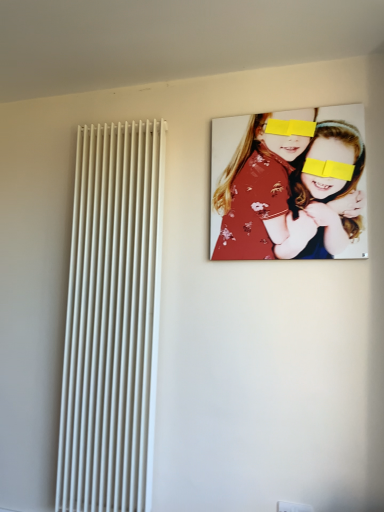
Question: Can you confirm if white smooth radiator at left is positioned to the right of floral fabric portrait at upper right?

Choices:
 (A) no
 (B) yes

Answer: (A)

Question: Is white smooth radiator at left at the left side of floral fabric portrait at upper right?

Choices:
 (A) no
 (B) yes

Answer: (B)

Question: From a real-world perspective, is white smooth radiator at left located beneath floral fabric portrait at upper right?

Choices:
 (A) yes
 (B) no

Answer: (A)

Question: From the image's perspective, is white smooth radiator at left over floral fabric portrait at upper right?

Choices:
 (A) yes
 (B) no

Answer: (B)

Question: Does white smooth radiator at left contain floral fabric portrait at upper right?

Choices:
 (A) yes
 (B) no

Answer: (B)

Question: Is white smooth radiator at left facing away from floral fabric portrait at upper right?

Choices:
 (A) yes
 (B) no

Answer: (B)

Question: Is floral fabric portrait at upper right next to white smooth radiator at left?

Choices:
 (A) yes
 (B) no

Answer: (B)

Question: Can you confirm if floral fabric portrait at upper right is taller than white smooth radiator at left?

Choices:
 (A) no
 (B) yes

Answer: (A)

Question: From a real-world perspective, is floral fabric portrait at upper right below white smooth radiator at left?

Choices:
 (A) no
 (B) yes

Answer: (A)

Question: Does floral fabric portrait at upper right have a larger size compared to white smooth radiator at left?

Choices:
 (A) no
 (B) yes

Answer: (A)

Question: Can white smooth radiator at left be found inside floral fabric portrait at upper right?

Choices:
 (A) no
 (B) yes

Answer: (A)

Question: Is floral fabric portrait at upper right behind white smooth radiator at left?

Choices:
 (A) yes
 (B) no

Answer: (B)

Question: Is point (294, 172) positioned closer to the camera than point (150, 393)?

Choices:
 (A) farther
 (B) closer

Answer: (B)